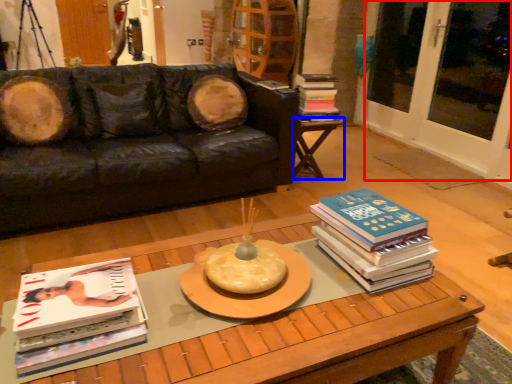
Question: Which point is further to the camera, screen door (highlighted by a red box) or table (highlighted by a blue box)?

Choices:
 (A) screen door
 (B) table

Answer: (B)